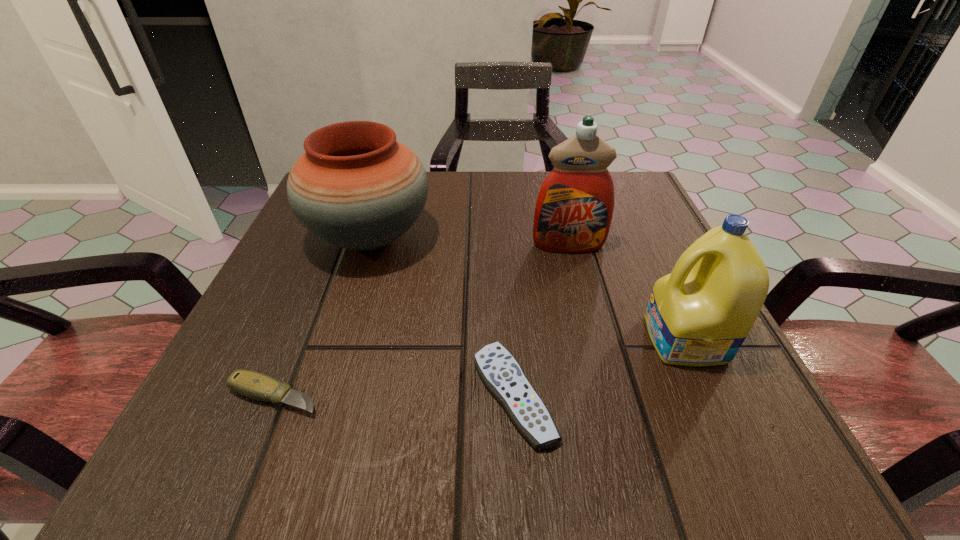
Locate an element on the screen. free spot located 0.140m on the right of the pottery is located at coordinates (503, 238).

The height and width of the screenshot is (540, 960). I want to click on free spot located on the back of the pocketknife, so click(344, 227).

Where is `vacant space located on the right of the remote control`? This screenshot has height=540, width=960. vacant space located on the right of the remote control is located at coordinates [731, 395].

At what (x,y) coordinates should I click in order to perform the action: click on object that is at the far edge. Please return your answer as a coordinate pair (x, y). This screenshot has width=960, height=540. Looking at the image, I should click on (356, 187).

You are a GUI agent. You are given a task and a screenshot of the screen. Output one action in this format:
    pyautogui.click(x=<x>, y=<y>)
    Task: Click on the pocketknife located at the near edge
    This screenshot has height=540, width=960.
    Given the screenshot: What is the action you would take?
    pyautogui.click(x=251, y=384)

I want to click on remote control at the near edge, so click(501, 373).

The image size is (960, 540). What are the coordinates of `pottery that is positioned at the left edge` in the screenshot? It's located at (356, 187).

The height and width of the screenshot is (540, 960). I want to click on pocketknife at the left edge, so click(251, 384).

The height and width of the screenshot is (540, 960). In order to click on object at the far left corner in this screenshot , I will do `click(356, 187)`.

Image resolution: width=960 pixels, height=540 pixels. Identify the location of object present at the near left corner. (251, 384).